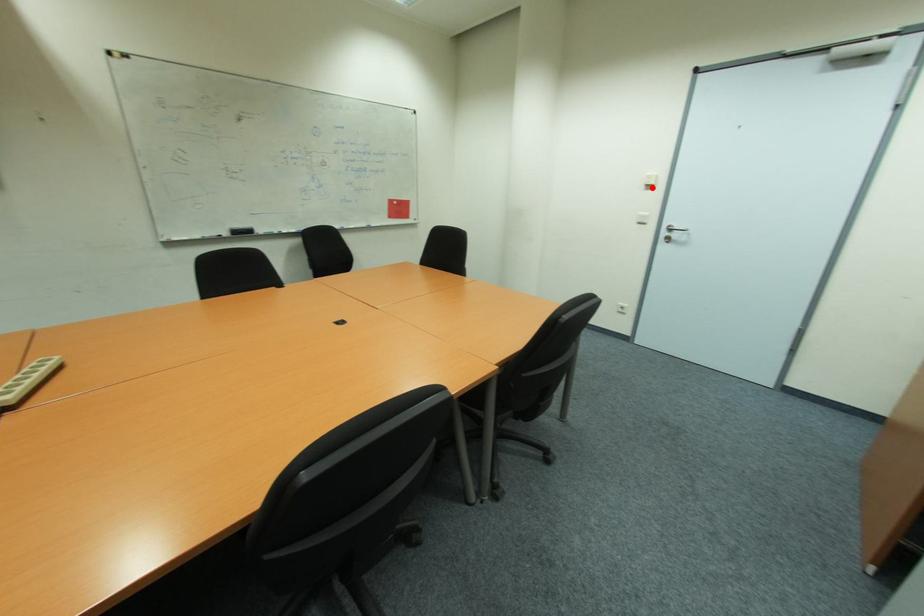
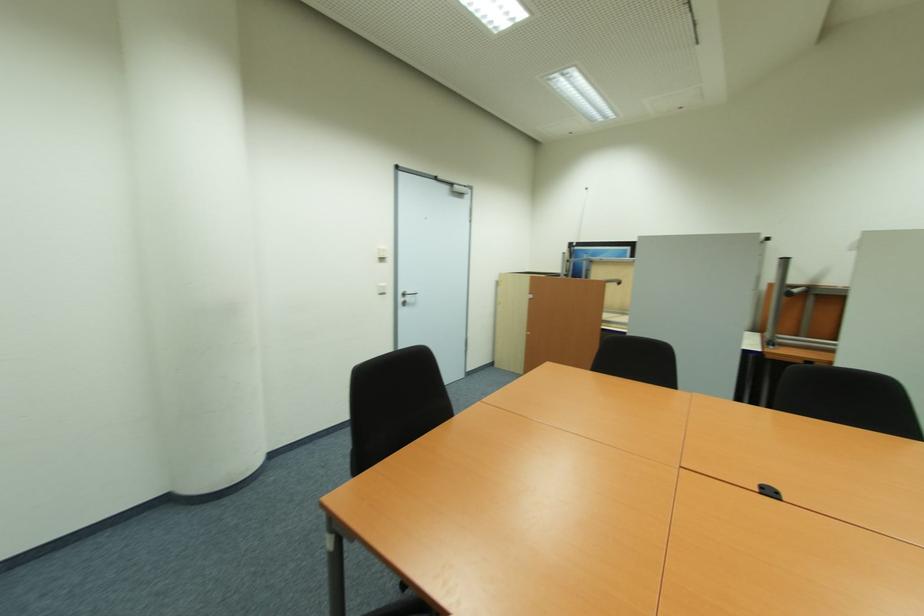
Find the pixel in the second image that matches the highlighted location in the first image.

(385, 260)